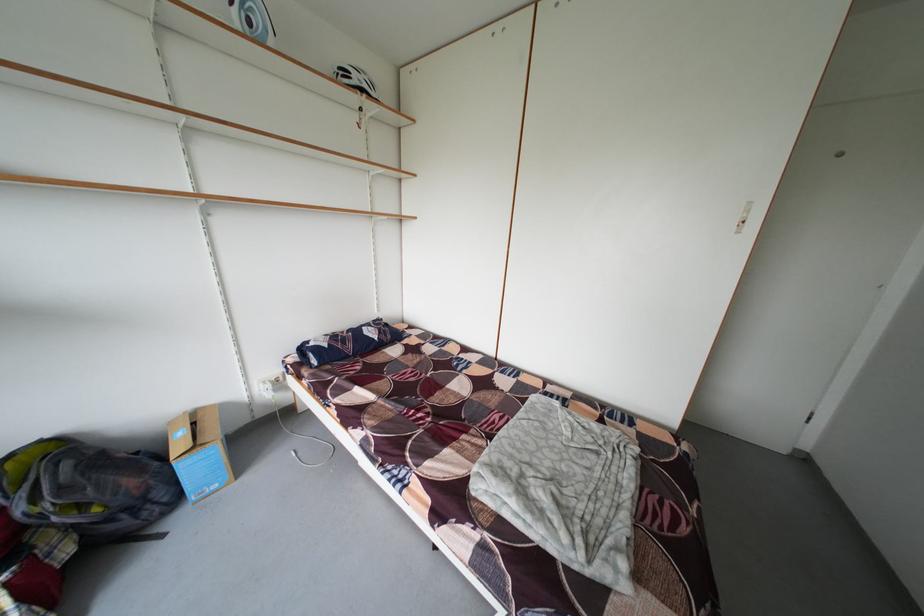
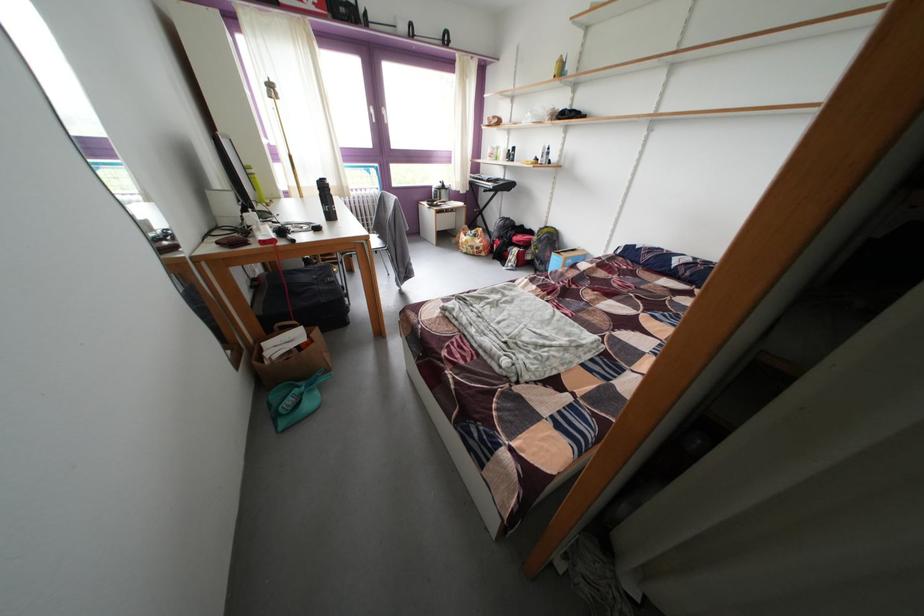
The point at (x=134, y=528) is marked in the first image. Where is the corresponding point in the second image?

(548, 269)